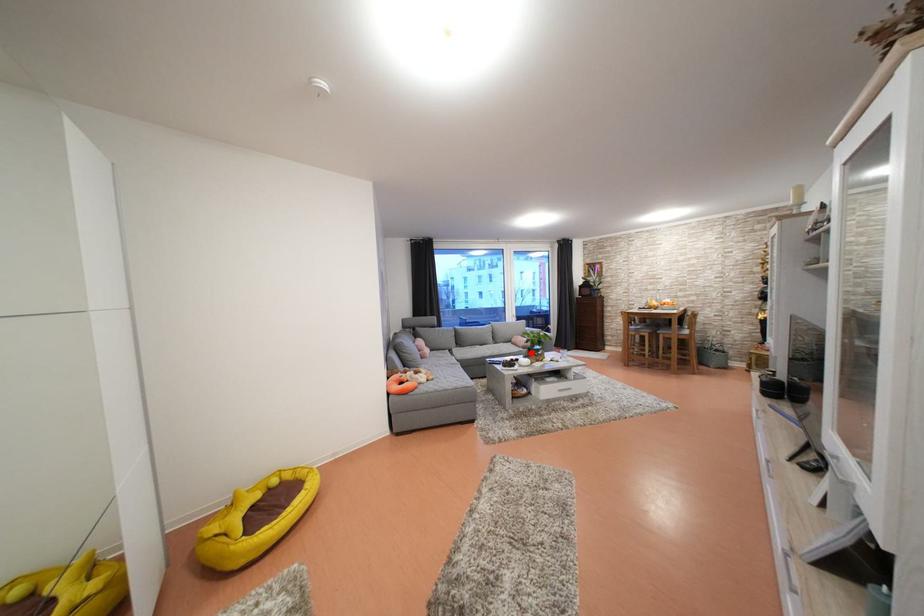
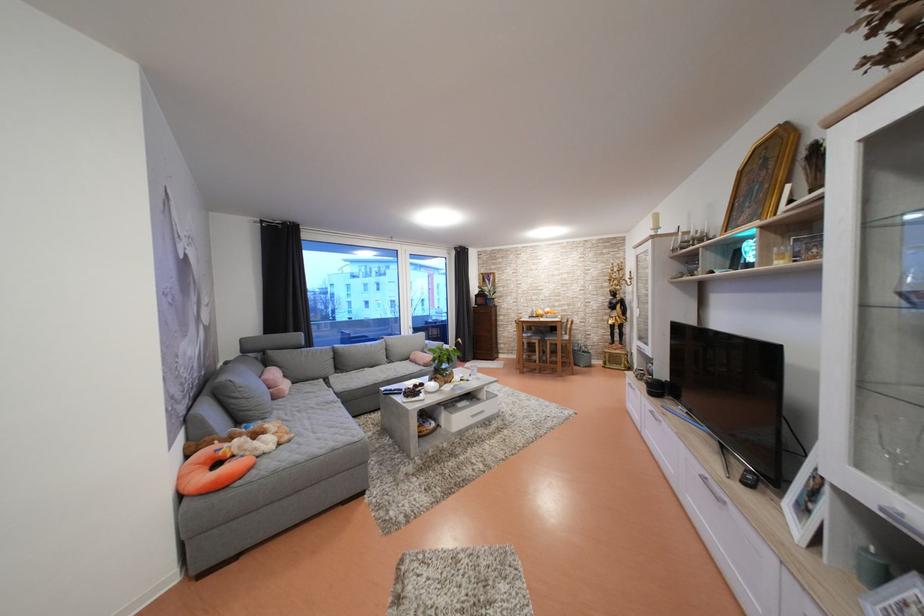
Question: I am providing you with two images of the same scene from different viewpoints. Given a red point in image1, look at the same physical point in image2. Is it:

Choices:
 (A) Closer to the viewpoint
 (B) Farther from the viewpoint

Answer: (B)